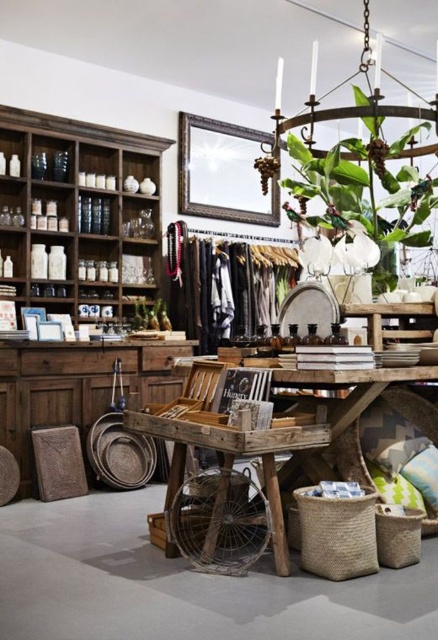
Question: Which point is farther to the camera?

Choices:
 (A) rustic wood cart at center
 (B) green leafy plant at upper center

Answer: (B)

Question: Is green leafy plant at upper center in front of rustic wood cart at center?

Choices:
 (A) no
 (B) yes

Answer: (A)

Question: Among these points, which one is nearest to the camera?

Choices:
 (A) (29, 113)
 (B) (299, 218)
 (C) (175, 476)
 (D) (427, 484)

Answer: (C)

Question: Does dark brown wood shelves at upper left appear on the left side of fluffy green pillow at lower right?

Choices:
 (A) no
 (B) yes

Answer: (B)

Question: Which point is closer to the camera?

Choices:
 (A) rustic wood cart at center
 (B) dark brown wood shelves at upper left
 (C) green leafy plant at upper center
 (D) fluffy green pillow at lower right

Answer: (A)

Question: Can you confirm if dark brown wood shelves at upper left is thinner than fluffy green pillow at lower right?

Choices:
 (A) yes
 (B) no

Answer: (B)